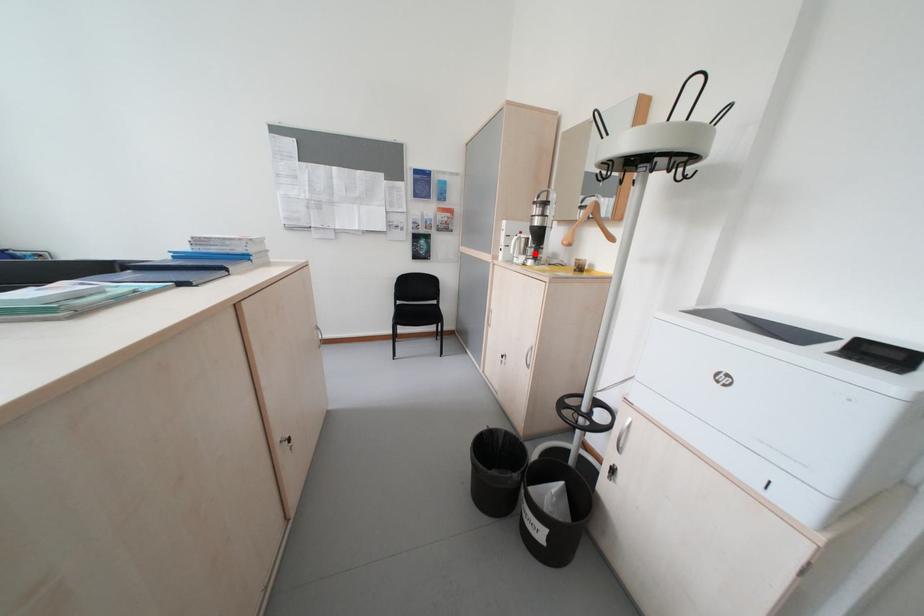
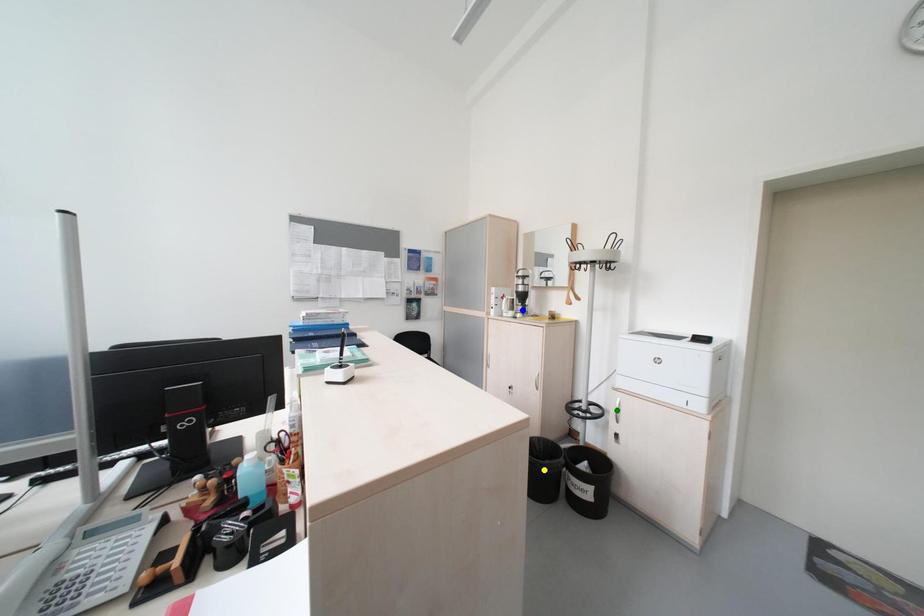
Question: I am providing you with two images of the same scene from different viewpoints. A red point is marked on the first image. You are given multiple points on the second image. Which point in image 2 is actually the same real-world point as the red point in image 1?

Choices:
 (A) blue point
 (B) yellow point
 (C) green point

Answer: (A)